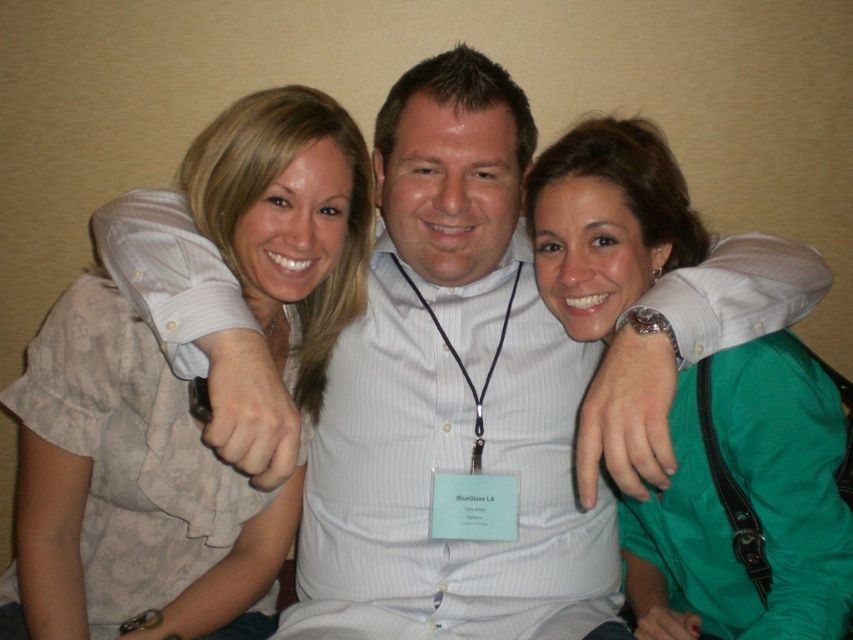
Based on the scene description, where is the white striped shirt at center located in terms of coordinates?

The white striped shirt at center is located at coordinates point (450, 396).

Based on the scene description, which of the two blouses, the light beige blouse at center or the green satin blouse at center, is taller?

The light beige blouse at center is much taller than the green satin blouse at center according to the description.